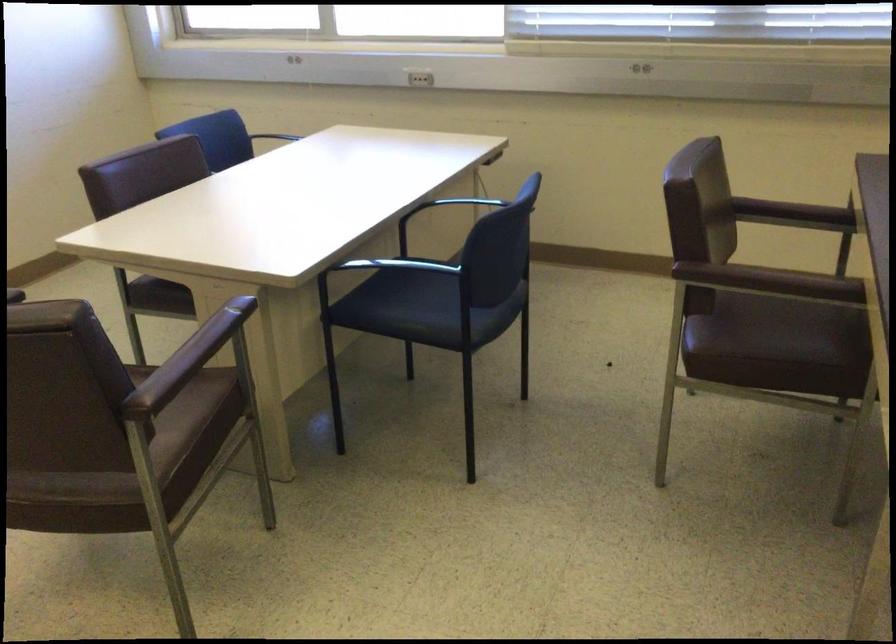
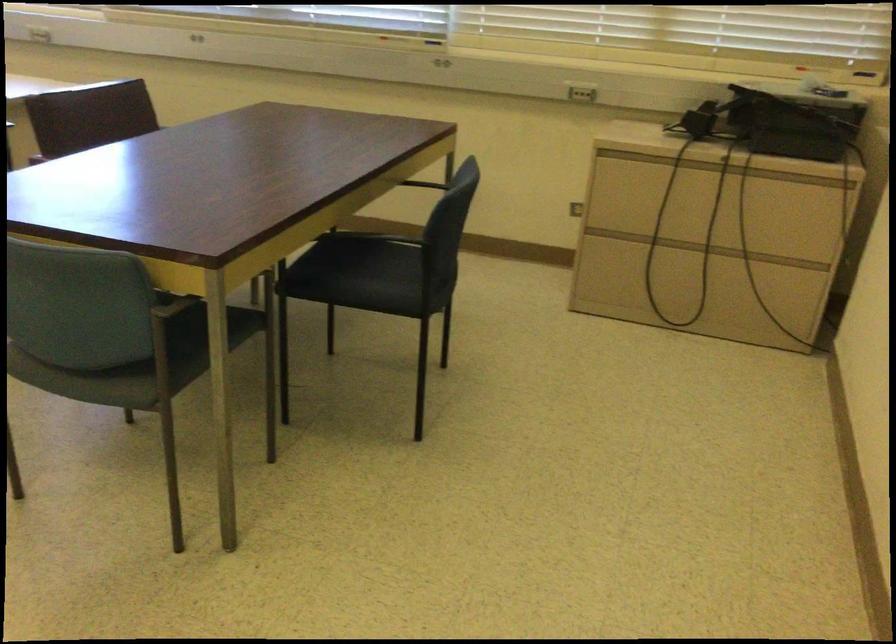
In a continuous first-person perspective shot, in which direction is the camera moving?

The cameraman walked toward right, backward.